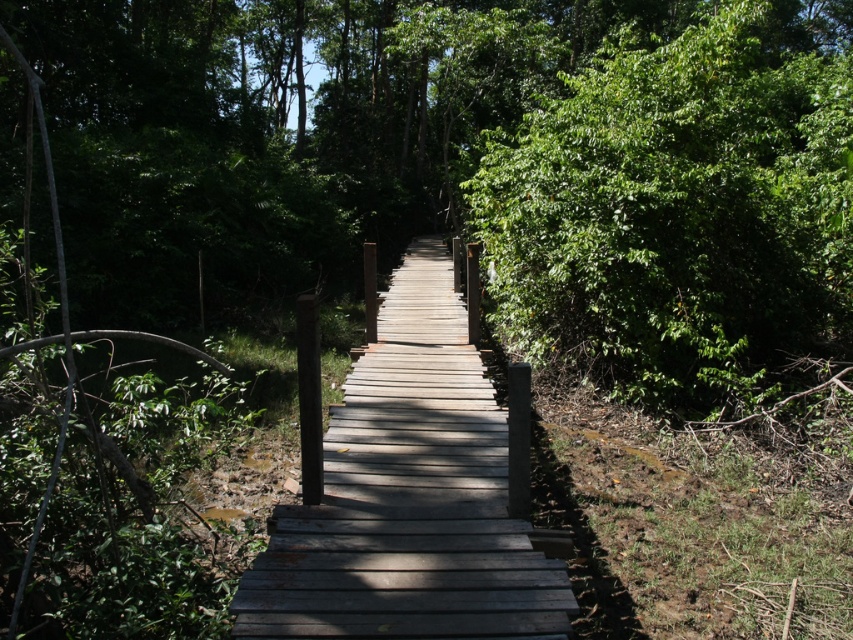
Can you confirm if green leafy bush at right is wider than gray wooden bridge at center?

Correct, the width of green leafy bush at right exceeds that of gray wooden bridge at center.

Which is below, green leafy bush at right or gray wooden bridge at center?

gray wooden bridge at center is lower down.

Is point (474, 180) less distant than point (317, 572)?

No, it is behind (317, 572).

At what (x,y) coordinates should I click in order to perform the action: click on green leafy bush at right. Please return your answer as a coordinate pair (x, y). This screenshot has height=640, width=853. Looking at the image, I should click on (680, 209).